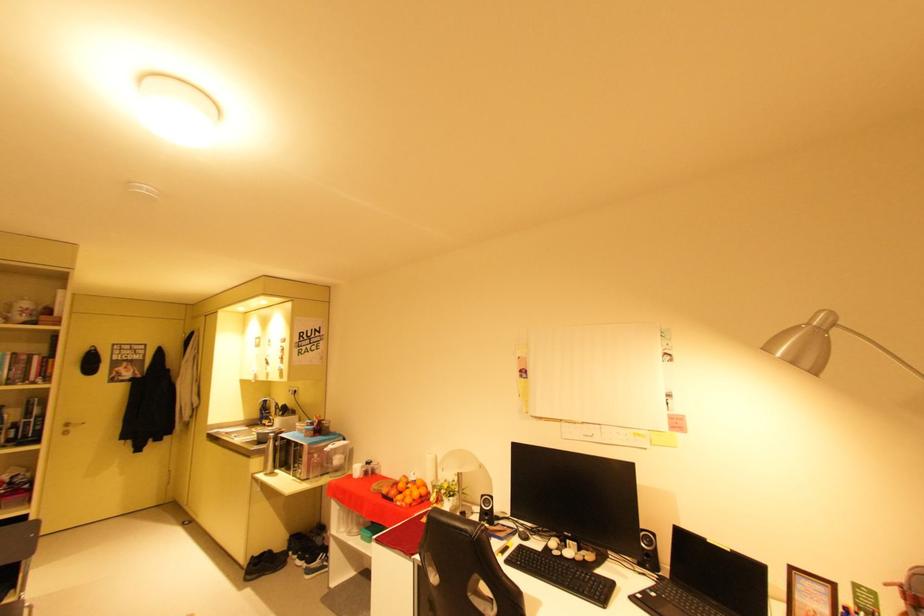
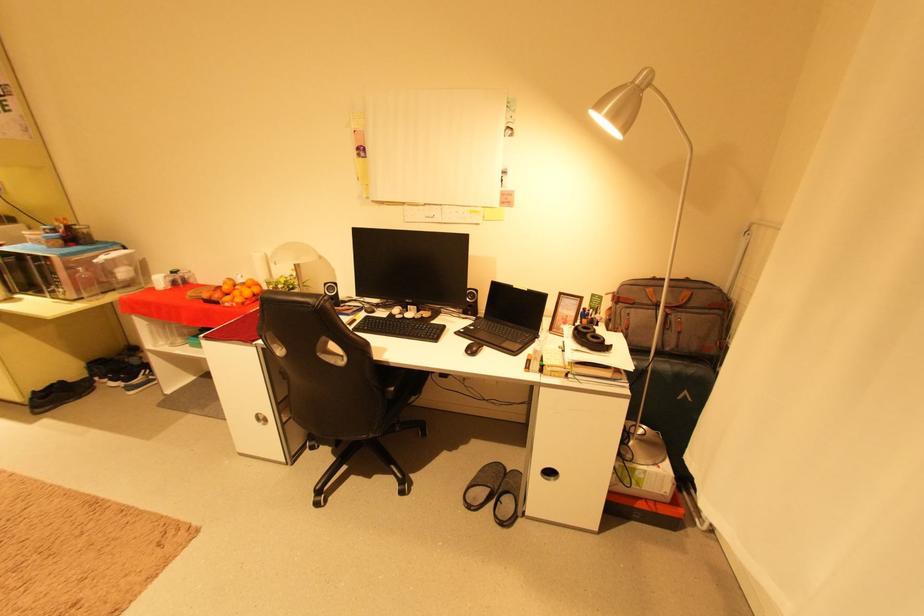
Locate, in the second image, the point that corresponds to point (652, 543) in the first image.

(477, 298)